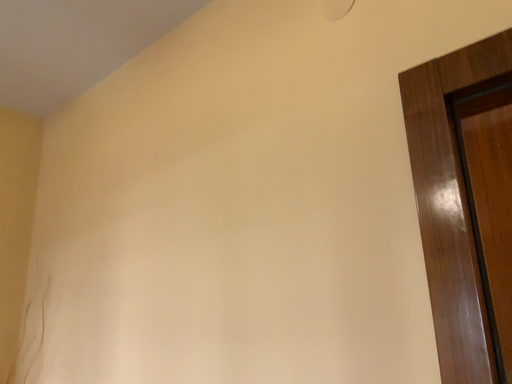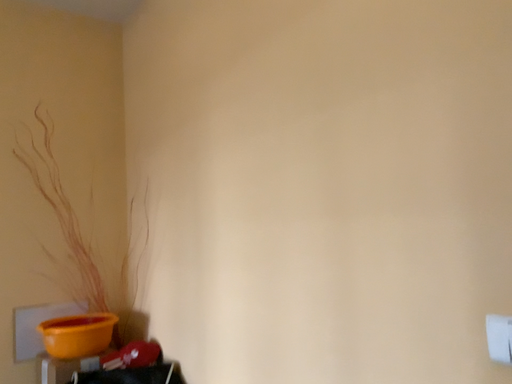
Question: How did the camera likely rotate when shooting the video?

Choices:
 (A) rotated left
 (B) rotated right

Answer: (A)